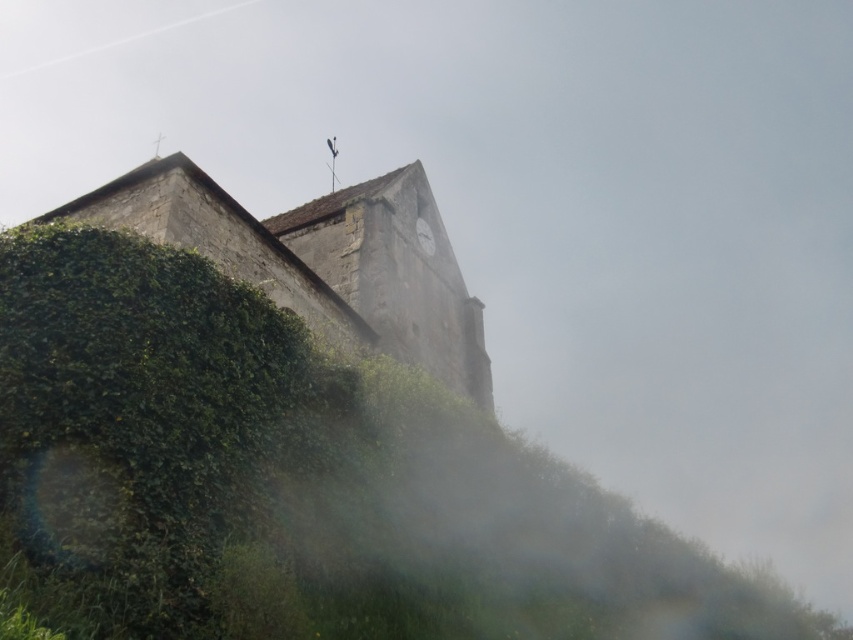
Question: Which of the following is the farthest from the observer?

Choices:
 (A) (459, 346)
 (B) (111, 532)

Answer: (A)

Question: Is the position of green leafy hedge at left more distant than that of stone clock tower at center?

Choices:
 (A) yes
 (B) no

Answer: (B)

Question: Can you confirm if green leafy hedge at left is thinner than stone clock tower at center?

Choices:
 (A) yes
 (B) no

Answer: (A)

Question: Is green leafy hedge at left in front of stone clock tower at center?

Choices:
 (A) yes
 (B) no

Answer: (A)

Question: Which object appears farthest from the camera in this image?

Choices:
 (A) stone clock tower at center
 (B) green leafy hedge at left

Answer: (A)